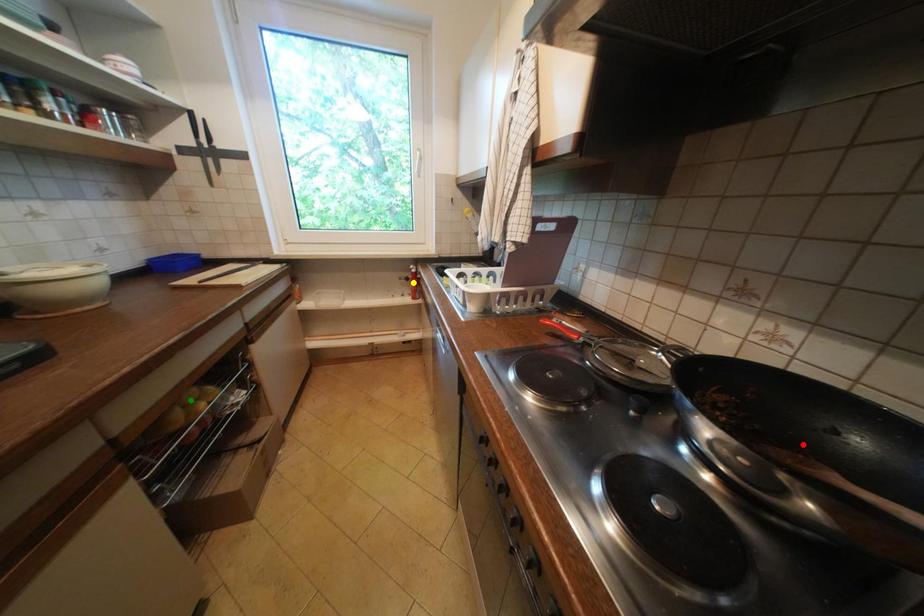
Order these from nearest to farthest:
yellow point | red point | green point

red point, green point, yellow point